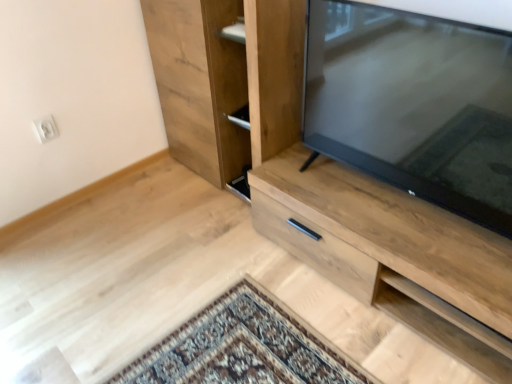
Question: Is light wood cabinet at center to the left or to the right of natural wood cupboard at center in the image?

Choices:
 (A) left
 (B) right

Answer: (B)

Question: In terms of width, does light wood cabinet at center look wider or thinner when compared to natural wood cupboard at center?

Choices:
 (A) thin
 (B) wide

Answer: (B)

Question: Considering the real-world distances, which object is closest to the light wood cabinet at center?

Choices:
 (A) matte black tv at right
 (B) natural wood cupboard at center

Answer: (A)

Question: Estimate the real-world distances between objects in this image. Which object is closer to the light wood cabinet at center?

Choices:
 (A) matte black tv at right
 (B) natural wood cupboard at center

Answer: (A)